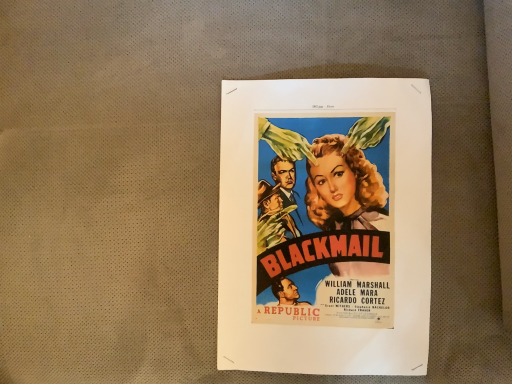
At what (x,y) coordinates should I click in order to perform the action: click on free space above vibrant paper poster at center (from a real-world perspective). Please return your answer as a coordinate pair (x, y). The image size is (512, 384). Looking at the image, I should click on (329, 197).